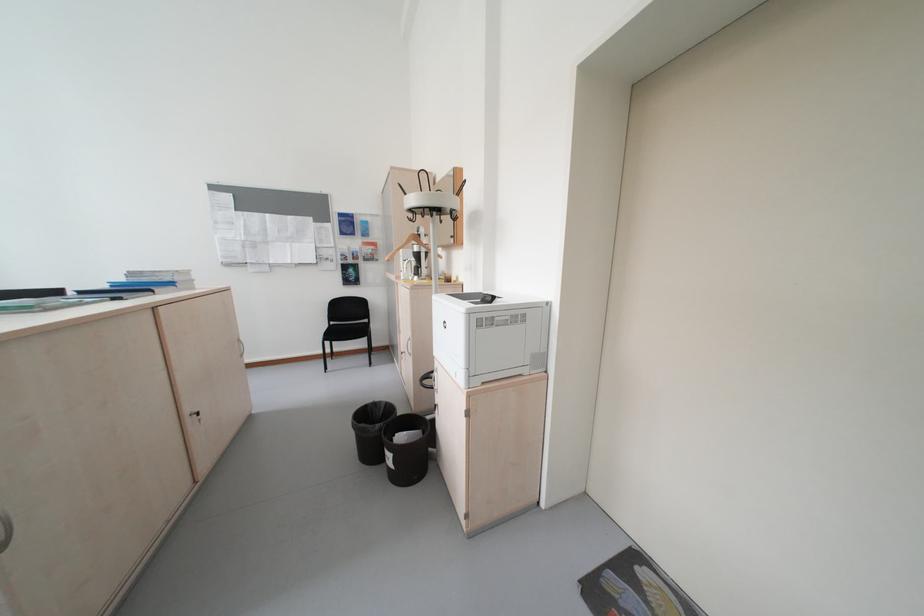
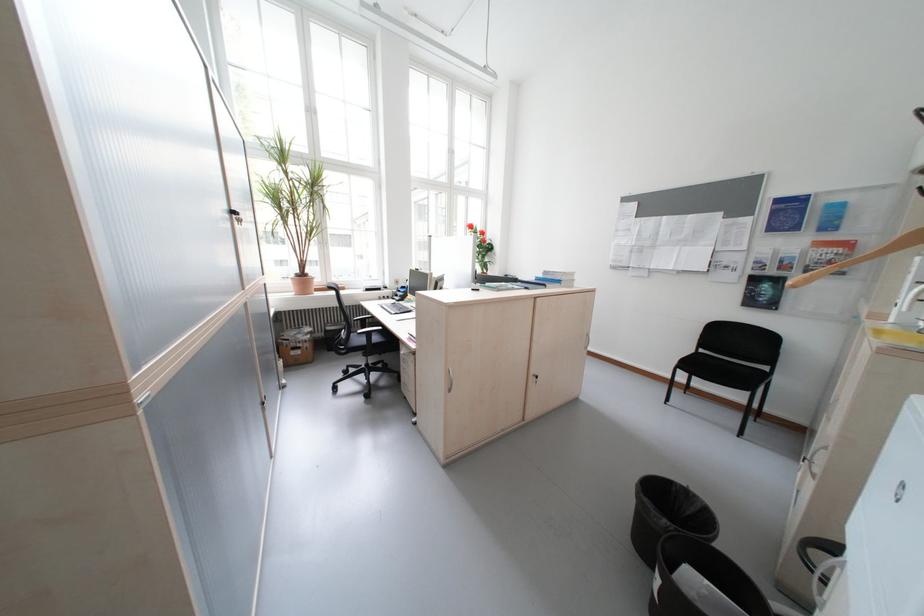
Locate, in the second image, the point that corresponds to point (372, 333) in the first image.

(758, 382)